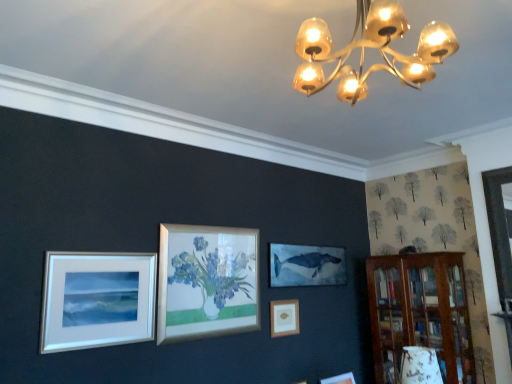
Question: Does wooden bookshelf at right have a lesser height compared to wooden frame at center, the first picture frame viewed from the back?

Choices:
 (A) no
 (B) yes

Answer: (A)

Question: Is wooden bookshelf at right positioned before wooden frame at center, the first picture frame viewed from the back?

Choices:
 (A) yes
 (B) no

Answer: (A)

Question: Is wooden frame at center, the 2th picture frame viewed from the left, at the back of wooden bookshelf at right?

Choices:
 (A) yes
 (B) no

Answer: (B)

Question: From the image's perspective, is wooden bookshelf at right over wooden frame at center, the first picture frame viewed from the back?

Choices:
 (A) yes
 (B) no

Answer: (B)

Question: Is wooden bookshelf at right completely or partially outside of wooden frame at center, the 1th picture frame from the bottom?

Choices:
 (A) no
 (B) yes

Answer: (B)

Question: From the image's perspective, is wooden bookshelf at right above or below white matte picture frame at lower left, which is the 1th picture frame from top to bottom?

Choices:
 (A) below
 (B) above

Answer: (A)

Question: Visually, is wooden bookshelf at right positioned to the left or to the right of white matte picture frame at lower left, which is the 2th picture frame from back to front?

Choices:
 (A) left
 (B) right

Answer: (B)

Question: In terms of width, does wooden bookshelf at right look wider or thinner when compared to white matte picture frame at lower left, the 2th picture frame from the right?

Choices:
 (A) wide
 (B) thin

Answer: (A)

Question: Is point (455, 370) closer or farther from the camera than point (140, 278)?

Choices:
 (A) farther
 (B) closer

Answer: (A)

Question: From the image's perspective, is white matte picture frame at lower left, which is the 1th picture frame from top to bottom, above or below wooden frame at center, the 1th picture frame from the bottom?

Choices:
 (A) below
 (B) above

Answer: (B)

Question: Is point (113, 321) closer or farther from the camera than point (282, 322)?

Choices:
 (A) closer
 (B) farther

Answer: (A)

Question: Considering the positions of white matte picture frame at lower left, which is the second picture frame from bottom to top, and wooden frame at center, the 1th picture frame when ordered from right to left, in the image, is white matte picture frame at lower left, which is the second picture frame from bottom to top, bigger or smaller than wooden frame at center, the 1th picture frame when ordered from right to left,?

Choices:
 (A) small
 (B) big

Answer: (B)

Question: From their relative heights in the image, would you say white matte picture frame at lower left, the 2th picture frame from the right, is taller or shorter than wooden frame at center, which appears as the second picture frame when viewed from the top?

Choices:
 (A) short
 (B) tall

Answer: (B)

Question: Is metallic gold chandelier at upper center wider or thinner than wooden frame at center, the 1th picture frame when ordered from right to left?

Choices:
 (A) thin
 (B) wide

Answer: (B)

Question: Visually, is metallic gold chandelier at upper center positioned to the left or to the right of wooden frame at center, which appears as the second picture frame when viewed from the top?

Choices:
 (A) left
 (B) right

Answer: (B)